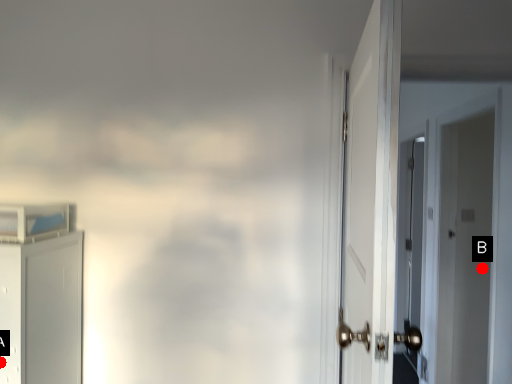
Question: Two points are circled on the image, labeled by A and B beside each circle. Which point appears farthest from the camera in this image?

Choices:
 (A) A is further
 (B) B is further

Answer: (B)